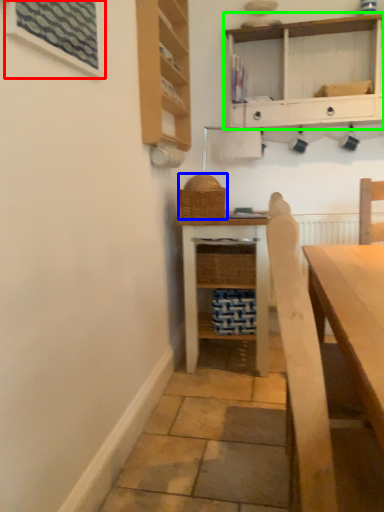
Question: Considering the real-world distances, which object is farthest from window (highlighted by a red box)? basket (highlighted by a blue box) or shelf (highlighted by a green box)?

Choices:
 (A) basket
 (B) shelf

Answer: (B)